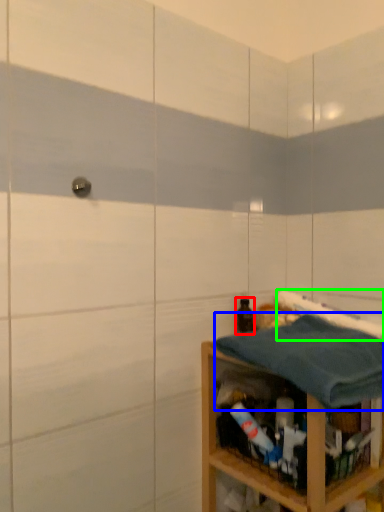
Question: Which is nearer to the bottle (highlighted by a red box)? bath towel (highlighted by a blue box) or bath towel (highlighted by a green box).

Choices:
 (A) bath towel
 (B) bath towel

Answer: (B)